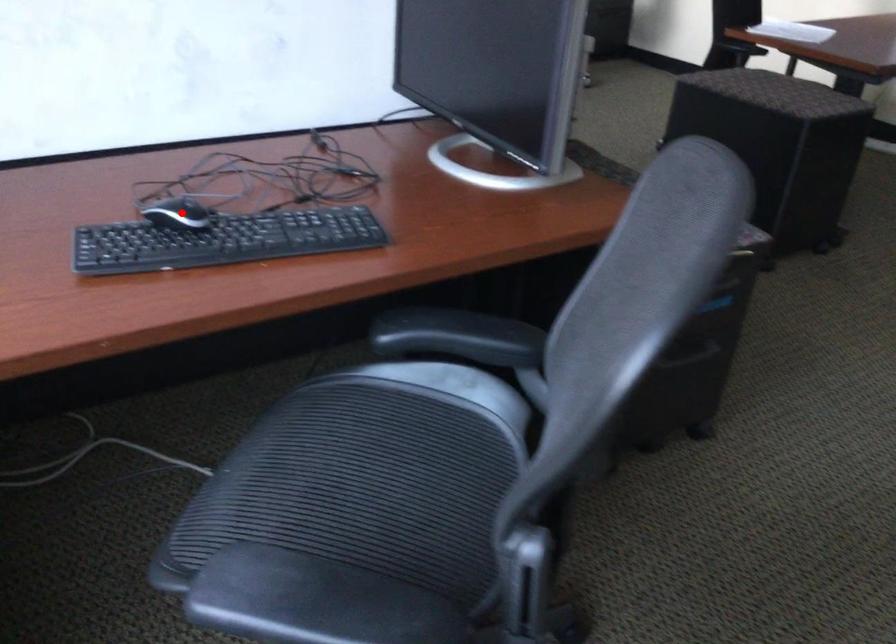
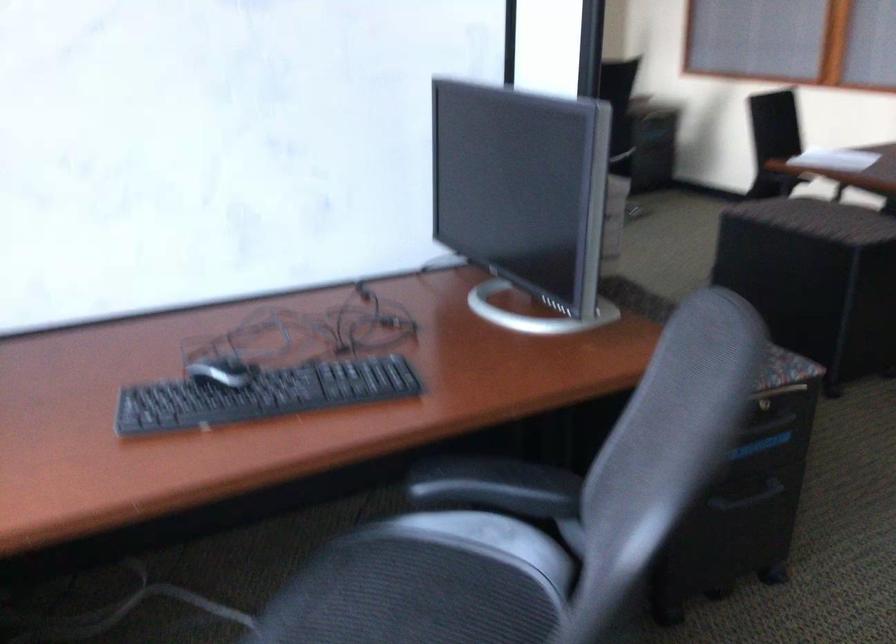
Find the pixel in the second image that matches the highlighted location in the first image.

(220, 371)